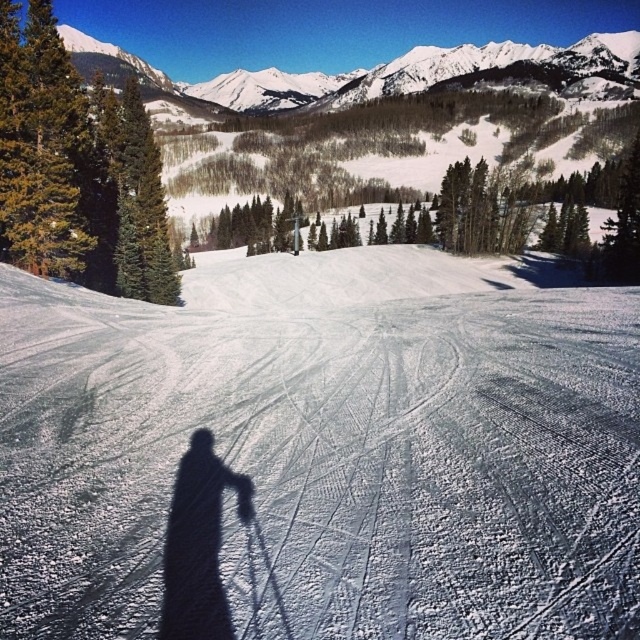
Question: Considering the relative positions of white snow at center and black shadow at center in the image provided, where is white snow at center located with respect to black shadow at center?

Choices:
 (A) above
 (B) below

Answer: (A)

Question: Is white snow at center wider than black shadow at center?

Choices:
 (A) no
 (B) yes

Answer: (B)

Question: Among these objects, which one is nearest to the camera?

Choices:
 (A) white snow at center
 (B) black shadow at center

Answer: (A)

Question: Does white snow at center have a smaller size compared to black shadow at center?

Choices:
 (A) no
 (B) yes

Answer: (A)